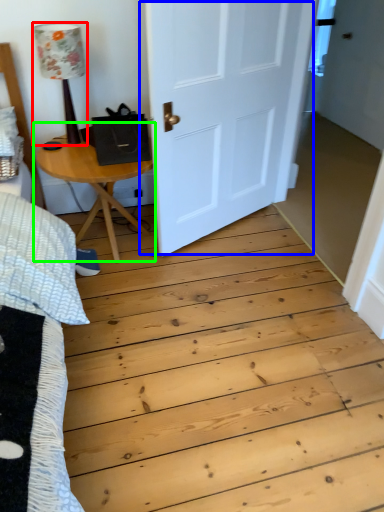
Question: Estimate the real-world distances between objects in this image. Which object is farther from lamp (highlighted by a red box), door (highlighted by a blue box) or table (highlighted by a green box)?

Choices:
 (A) door
 (B) table

Answer: (A)